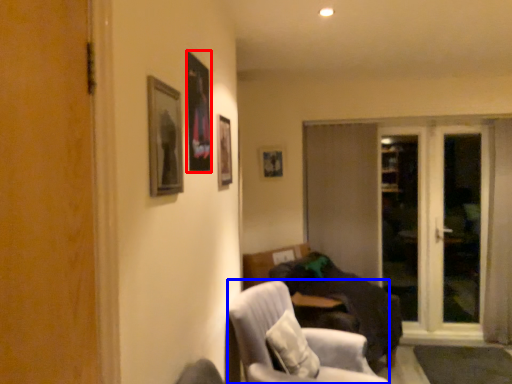
Question: Which point is further to the camera, picture frame (highlighted by a red box) or chair (highlighted by a blue box)?

Choices:
 (A) picture frame
 (B) chair

Answer: (B)